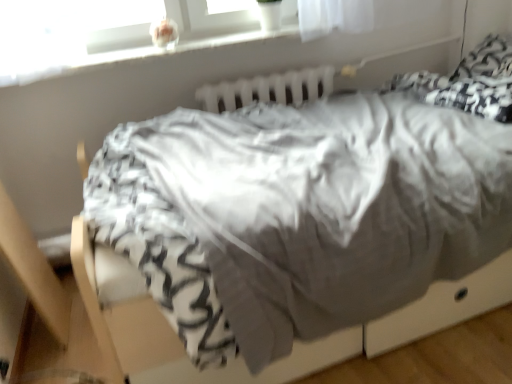
Question: Is white plastic radiator at upper center facing away from white plastic window sill at upper center?

Choices:
 (A) yes
 (B) no

Answer: (B)

Question: Is white plastic radiator at upper center facing towards white plastic window sill at upper center?

Choices:
 (A) yes
 (B) no

Answer: (B)

Question: Considering the relative sizes of white plastic radiator at upper center and white plastic window sill at upper center in the image provided, is white plastic radiator at upper center shorter than white plastic window sill at upper center?

Choices:
 (A) no
 (B) yes

Answer: (A)

Question: Does white plastic radiator at upper center have a lesser width compared to white plastic window sill at upper center?

Choices:
 (A) no
 (B) yes

Answer: (B)

Question: Is the surface of white plastic radiator at upper center in direct contact with white plastic window sill at upper center?

Choices:
 (A) yes
 (B) no

Answer: (B)

Question: Considering the relative sizes of white plastic radiator at upper center and white plastic window sill at upper center in the image provided, is white plastic radiator at upper center wider than white plastic window sill at upper center?

Choices:
 (A) no
 (B) yes

Answer: (A)

Question: Is white plastic window sill at upper center positioned beyond the bounds of white plastic radiator at upper center?

Choices:
 (A) no
 (B) yes

Answer: (B)

Question: Is white plastic window sill at upper center bigger than white plastic radiator at upper center?

Choices:
 (A) yes
 (B) no

Answer: (A)

Question: Would you say white plastic window sill at upper center contains white plastic radiator at upper center?

Choices:
 (A) yes
 (B) no

Answer: (B)

Question: Is white plastic window sill at upper center further to camera compared to white plastic radiator at upper center?

Choices:
 (A) no
 (B) yes

Answer: (A)

Question: Does white plastic window sill at upper center have a greater width compared to white plastic radiator at upper center?

Choices:
 (A) yes
 (B) no

Answer: (A)

Question: Can you confirm if white plastic window sill at upper center is thinner than white plastic radiator at upper center?

Choices:
 (A) no
 (B) yes

Answer: (A)

Question: Is white plastic radiator at upper center taller or shorter than white plastic window sill at upper center?

Choices:
 (A) short
 (B) tall

Answer: (B)